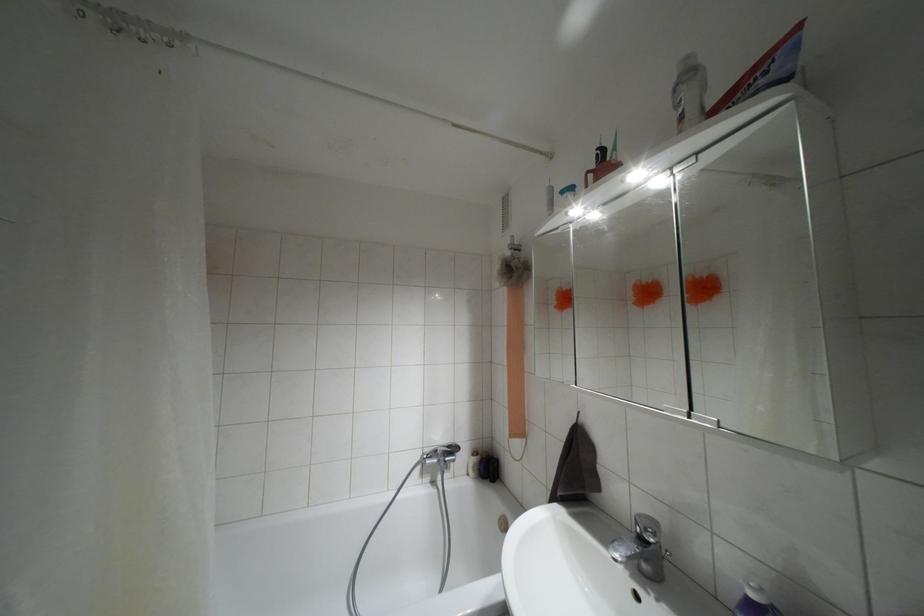
You are a GUI agent. You are given a task and a screenshot of the screen. Output one action in this format:
    pyautogui.click(x=<x>, y=<y>)
    Task: Click on the cabinet door handle
    The image size is (924, 616).
    Given the screenshot: What is the action you would take?
    pyautogui.click(x=690, y=416)